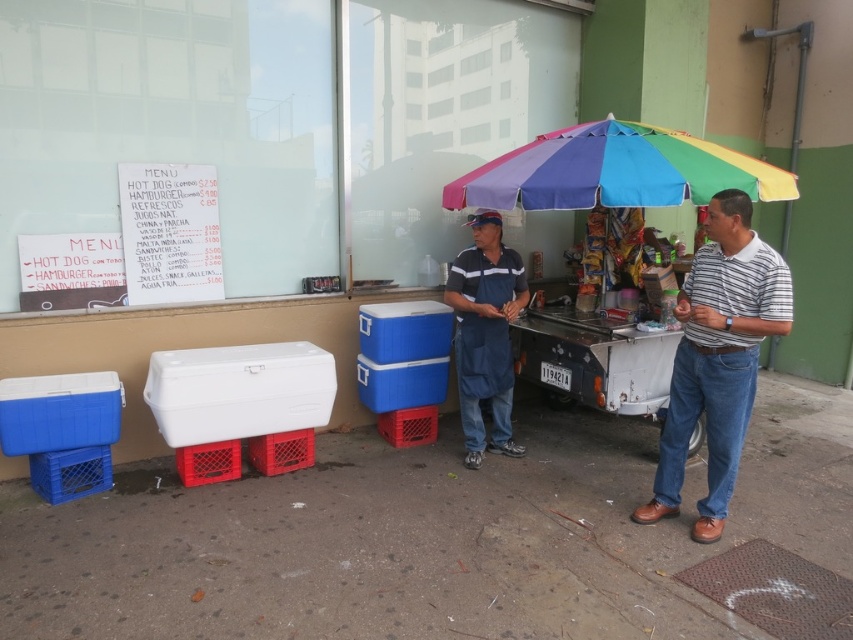
You are a customer looking to buy a hot dog from the vendor. You notice two items near the menu board on the left. Which item is smaller in size between the striped cotton polo shirt at right and the rainbow fabric umbrella at upper right?

The striped cotton polo shirt at right has a smaller size compared to the rainbow fabric umbrella at upper right, so the striped cotton polo shirt at right is smaller.

You are a customer at the street food vendor. You notice the striped cotton polo shirt at right and the rainbow fabric umbrella at upper right. Which of these two items is closer to you?

The striped cotton polo shirt at right is closer to you because it is in front of the rainbow fabric umbrella at upper right.

You are a food vendor who wants to adjust the distance between the rainbow fabric umbrella at upper right and the blue fabric shirt at center to exactly 30 inches. Currently, they are 31.77 inches apart. Which object should you move closer to achieve this? Please specify the direction to move the object.

To reduce the distance between the rainbow fabric umbrella at upper right and the blue fabric shirt at center from 31.77 inches to 30 inches, you should move either object toward the other by approximately 1.77 inches. Since the question specifies moving one object, you can choose to move either the rainbow fabric umbrella at upper right slightly to the left or the blue fabric shirt at center slightly to the right to close the gap.